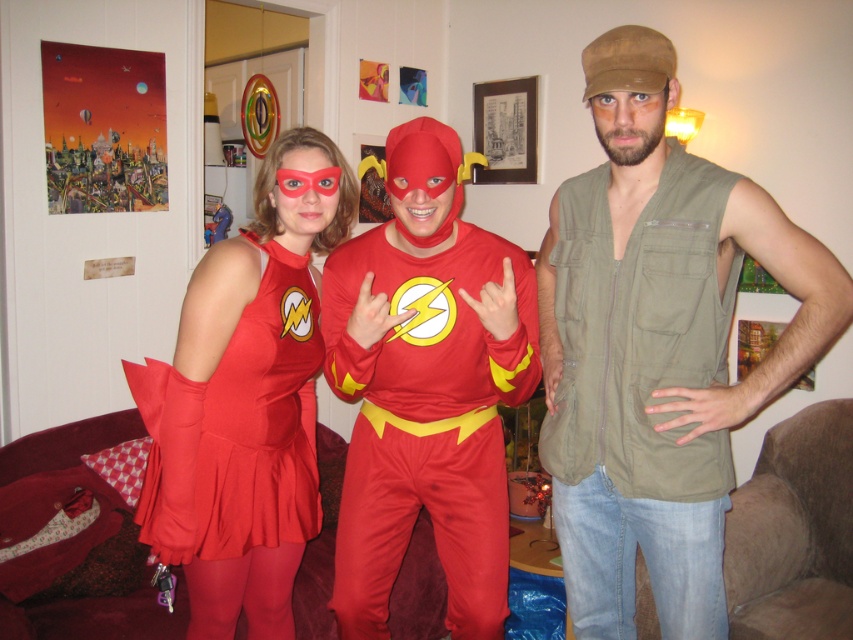
Who is shorter, matte red dress at center or matte red costume at upper left?

matte red costume at upper left is shorter.

Is point (258, 604) farther from camera compared to point (141, 138)?

No, it is in front of (141, 138).

At what (x,y) coordinates should I click in order to perform the action: click on matte red dress at center. Please return your answer as a coordinate pair (x, y). Image resolution: width=853 pixels, height=640 pixels. Looking at the image, I should click on (245, 400).

Which is more to the right, olive green sleeveless vest at center or matte red dress at center?

olive green sleeveless vest at center

This screenshot has height=640, width=853. I want to click on olive green sleeveless vest at center, so click(657, 348).

The height and width of the screenshot is (640, 853). I want to click on olive green sleeveless vest at center, so click(x=657, y=348).

Does olive green sleeveless vest at center have a smaller size compared to matte red costume at upper left?

Actually, olive green sleeveless vest at center might be larger than matte red costume at upper left.

Does olive green sleeveless vest at center appear under matte red costume at upper left?

Yes.

Does point (619, 93) lie behind point (88, 96)?

No, it is in front of (88, 96).

Identify the location of olive green sleeveless vest at center. The height and width of the screenshot is (640, 853). (657, 348).